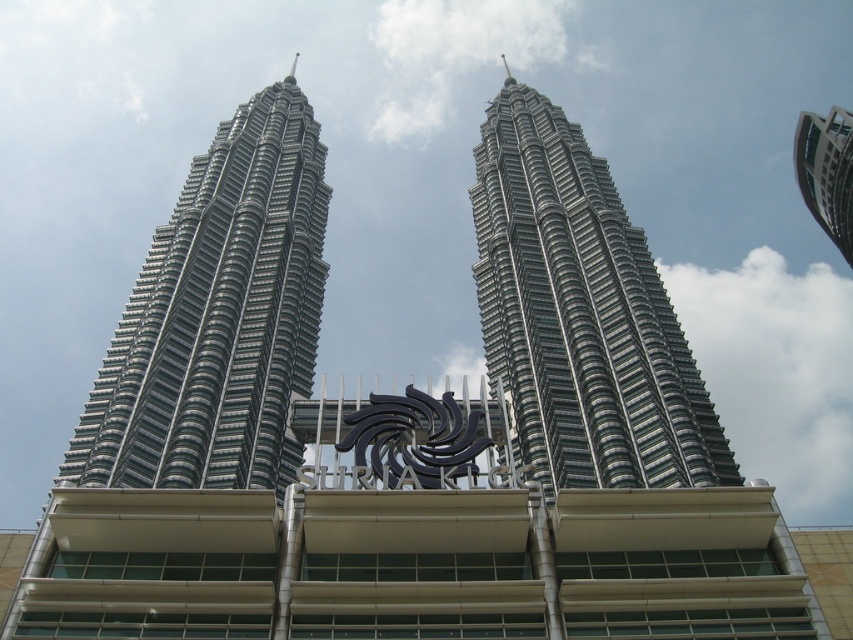
Is the position of silver metallic building at center more distant than that of silver metallic building at upper right?

No, silver metallic building at center is in front of silver metallic building at upper right.

Between point (154, 372) and point (825, 218), which one is positioned behind?

Point (825, 218)

The image size is (853, 640). Identify the location of silver metallic building at center. coord(218,316).

Is point (416, 420) positioned before point (831, 227)?

Yes, it is in front of point (831, 227).

Between black metal logo at center and silver metallic building at upper right, which one has more height?

silver metallic building at upper right

Which is in front, point (403, 452) or point (808, 148)?

Point (403, 452) is in front.

This screenshot has width=853, height=640. In order to click on black metal logo at center in this screenshot , I will do `click(415, 436)`.

Is silver metallic twin towers at center above black metal logo at center?

Yes, silver metallic twin towers at center is above black metal logo at center.

Find the location of a particular element. silver metallic twin towers at center is located at coordinates (581, 314).